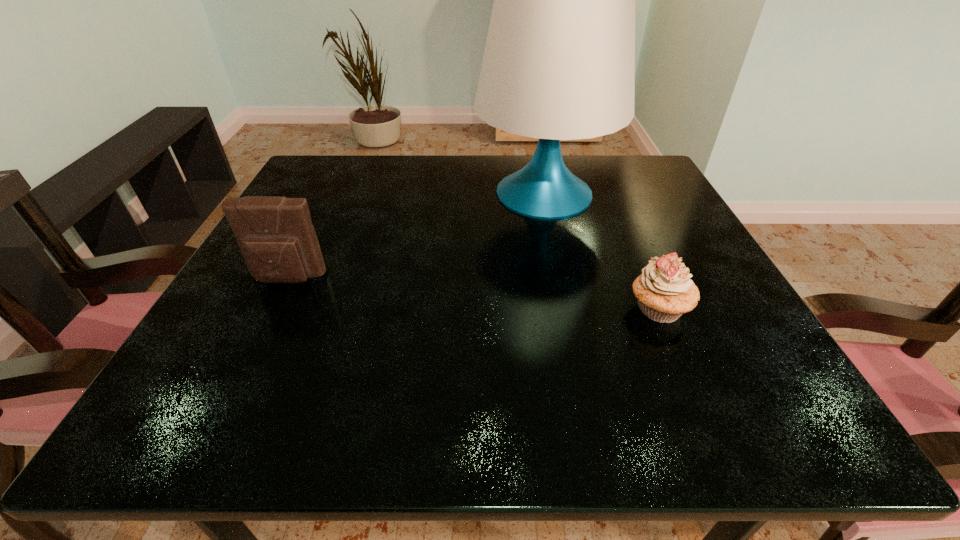
Locate an element on the screen. blank space located 0.400m on the left of the cupcake is located at coordinates (393, 309).

You are a GUI agent. You are given a task and a screenshot of the screen. Output one action in this format:
    pyautogui.click(x=<x>, y=<y>)
    Task: Click on the object positioned at the far edge
    Image resolution: width=960 pixels, height=540 pixels.
    Given the screenshot: What is the action you would take?
    pyautogui.click(x=559, y=62)

I want to click on object situated at the left edge, so click(x=276, y=236).

Identify the location of table lamp located in the right edge section of the desktop. (559, 62).

Locate an element on the screen. cupcake present at the right edge is located at coordinates (664, 291).

Where is `object that is at the far right corner`? object that is at the far right corner is located at coordinates (559, 62).

The width and height of the screenshot is (960, 540). In order to click on free space at the far edge of the desktop in this screenshot , I will do `click(422, 197)`.

Identify the location of vacant area at the near edge of the desktop. (x=332, y=413).

Locate an element on the screen. free space at the left edge of the desktop is located at coordinates (326, 262).

This screenshot has width=960, height=540. In the image, there is a desktop. Find the location of `vacant region at the right edge`. vacant region at the right edge is located at coordinates (654, 209).